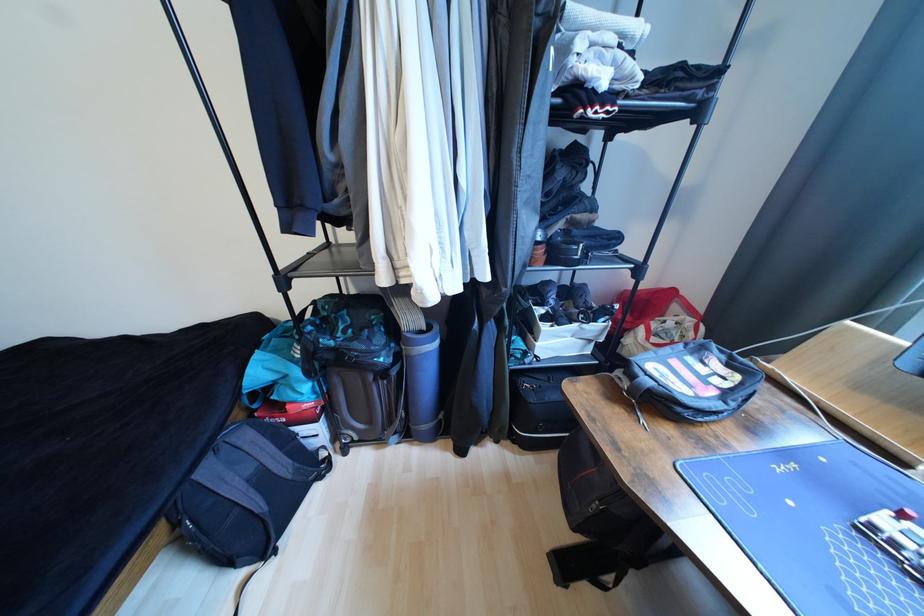
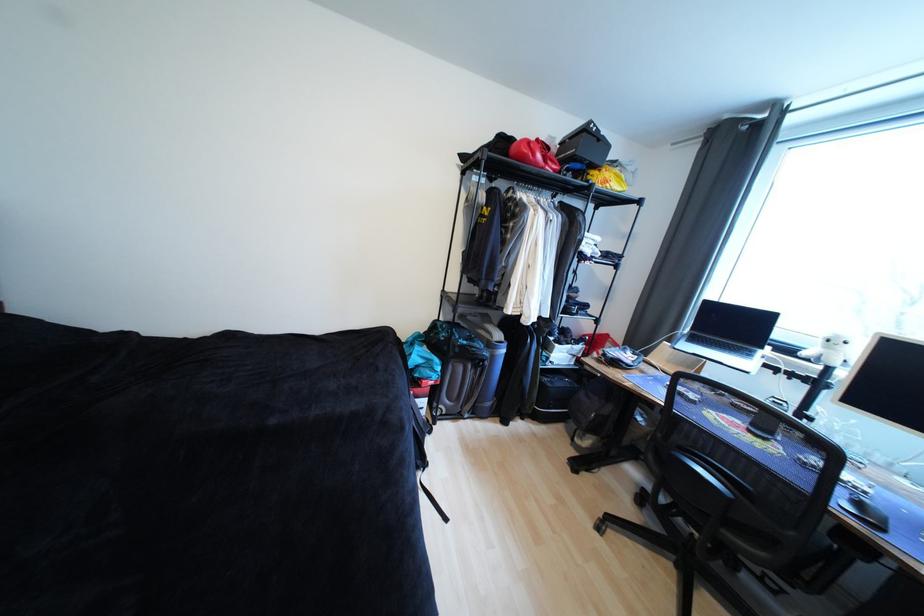
The point at (336,351) is marked in the first image. Where is the corresponding point in the second image?

(469, 347)